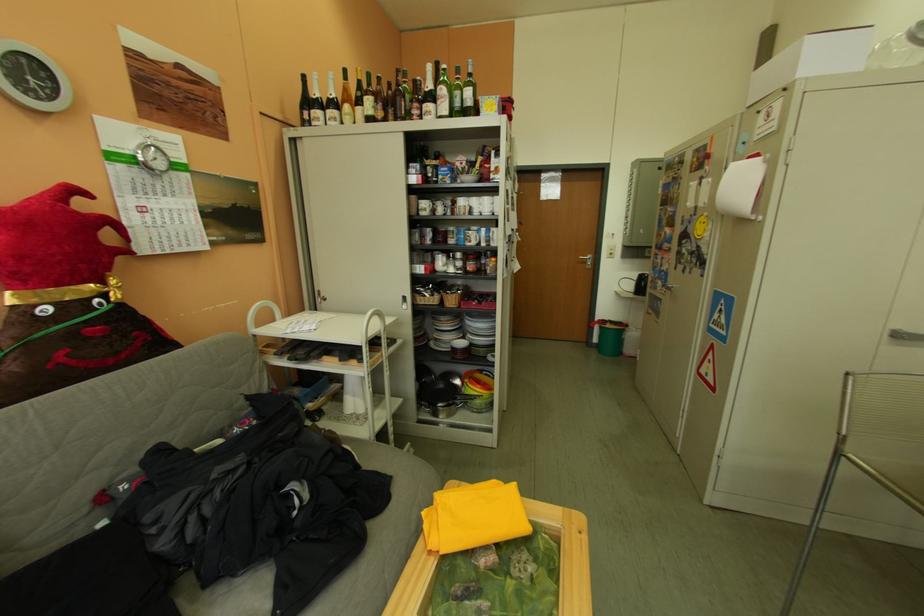
Describe the element at coordinates (289, 508) in the screenshot. I see `the gray sofa sitting surface` at that location.